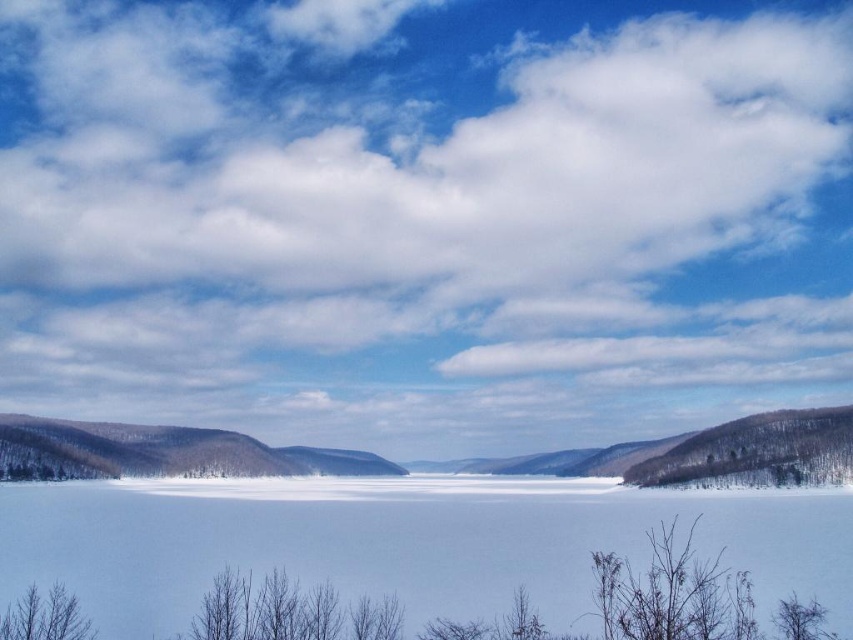
Who is lower down, white ice at center or brown bare branches at lower left?

white ice at center is lower down.

Where is `white ice at center`? This screenshot has width=853, height=640. white ice at center is located at coordinates (403, 541).

Is bare branches at lower right below brown bare branches at lower left?

Yes.

Who is taller, bare branches at lower right or brown bare branches at lower left?

bare branches at lower right

Does point (727, 621) lie in front of point (76, 596)?

No, (727, 621) is behind (76, 596).

You are a GUI agent. You are given a task and a screenshot of the screen. Output one action in this format:
    pyautogui.click(x=<x>, y=<y>)
    Task: Click on the bare branches at lower right
    The image size is (853, 640).
    Given the screenshot: What is the action you would take?
    pyautogui.click(x=672, y=593)

Who is positioned more to the left, brown textured mountain at center or snowy brown hillside at right?

brown textured mountain at center

Find the location of a particular element. This screenshot has width=853, height=640. brown textured mountain at center is located at coordinates (161, 452).

At what (x,y) coordinates should I click in order to perform the action: click on brown textured mountain at center. Please return your answer as a coordinate pair (x, y). Looking at the image, I should click on (161, 452).